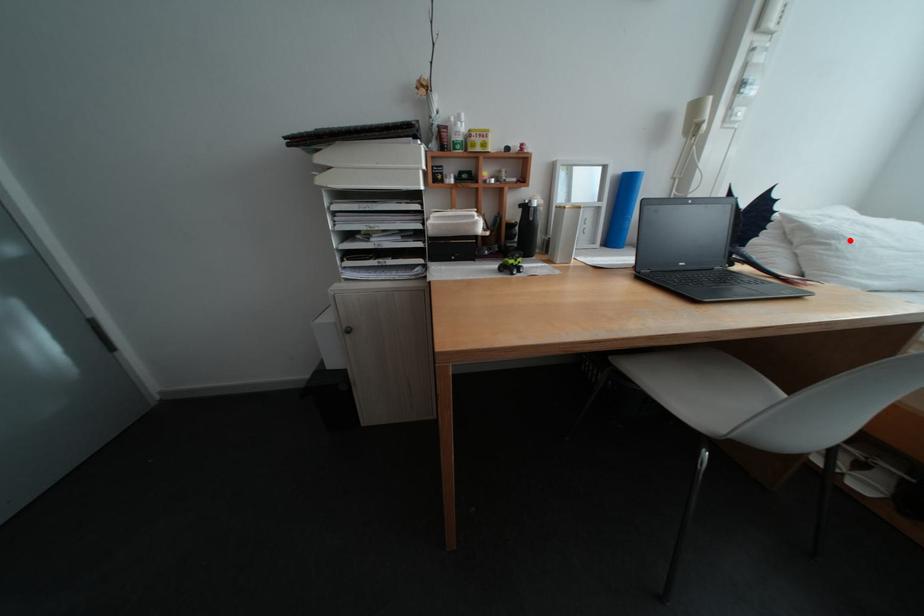
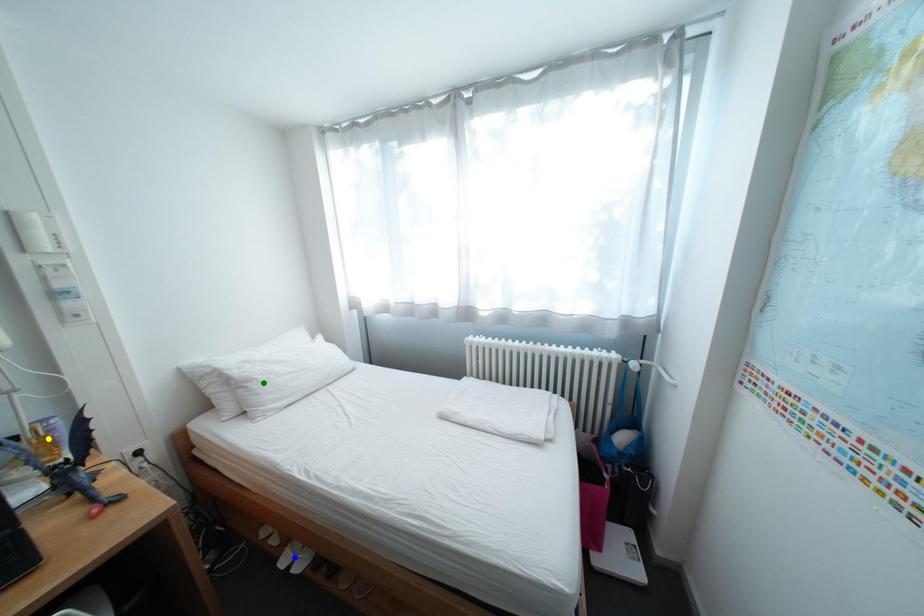
Question: I am providing you with two images of the same scene from different viewpoints. A red point is marked on the first image. You are given multiple points on the second image. Which point in image 2 represents the same 3d spot as the red point in image 1?

Choices:
 (A) yellow point
 (B) green point
 (C) blue point

Answer: (B)